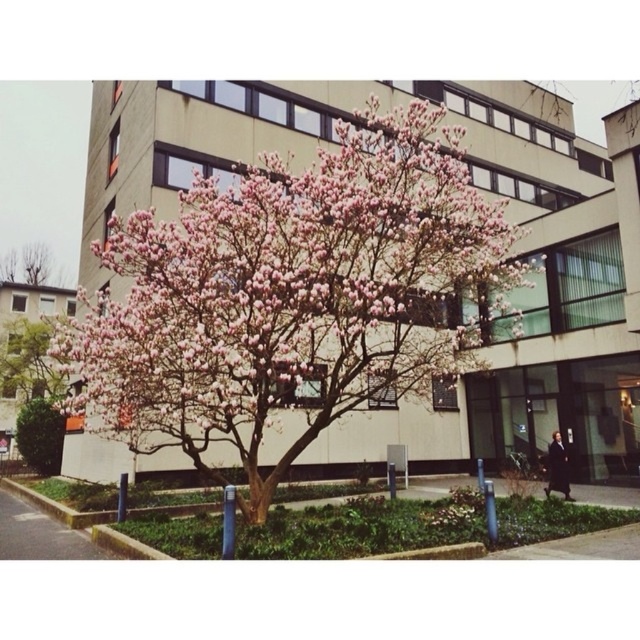
You are an architect designing a new garden layout. You have two pink bloom trees to place in the garden. The pink bloom tree at left and the pink bloom tree at upper left. Given their sizes, which one should you place closer to the entrance to ensure it doesn

The pink bloom tree at left occupies less space than the pink bloom tree at upper left. Therefore, the pink bloom tree at left should be placed closer to the entrance to ensure it doesn

You are standing in a garden and see the pink bloom tree at center and the pink bloom tree at upper left. Which tree is nearer to you?

The pink bloom tree at center is closer to the viewer than the pink bloom tree at upper left.

You are standing in a park and see the pink bloom tree at left. If you want to take a photo of the tree from a distance of 25 meters, will you need to move closer or farther away?

The pink bloom tree at left is currently 26.81 meters away from you. To achieve a distance of 25 meters, you need to move closer by approximately 1.81 meters.